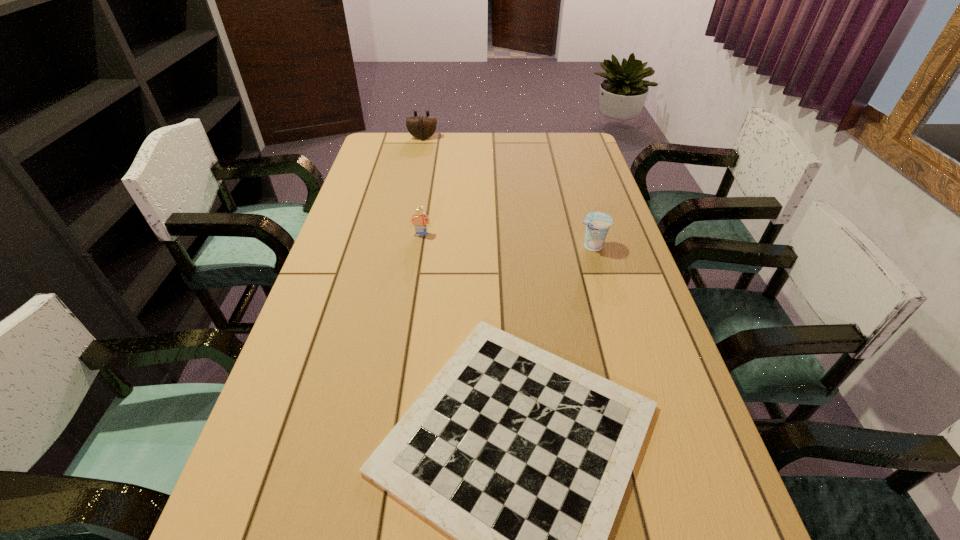
Choose which object is the nearest neighbor to the farthest object. Please provide its 2D coordinates. Your answer should be formatted as a tuple, i.e. [(x, y)], where the tuple contains the x and y coordinates of a point satisfying the conditions above.

[(420, 220)]

Where is `the third closest object to the second farthest object`? This screenshot has height=540, width=960. the third closest object to the second farthest object is located at coordinates (421, 127).

This screenshot has height=540, width=960. I want to click on free space that satisfies the following two spatial constraints: 1. with the flap open on the third farthest object; 2. on the right side of the farthest object, so click(400, 246).